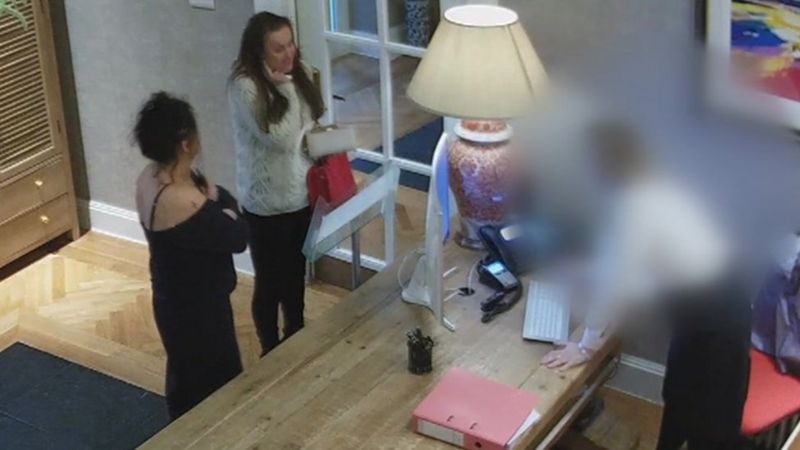
At what (x,y) coordinates should I click in order to perform the action: click on desk. Please return your answer as a coordinate pair (x, y). This screenshot has width=800, height=450. Looking at the image, I should click on (332, 384).